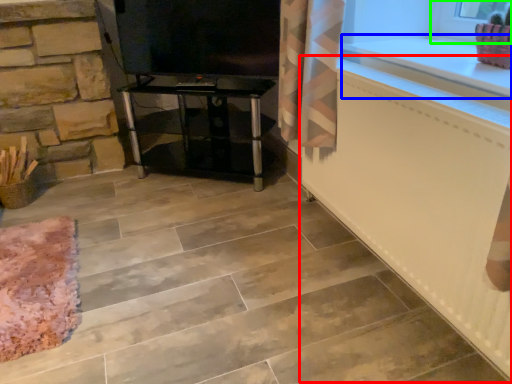
Question: Based on their relative distances, which object is nearer to radiator (highlighted by a red box)? Choose from counter top (highlighted by a blue box) and window frame (highlighted by a green box).

Choices:
 (A) counter top
 (B) window frame

Answer: (A)